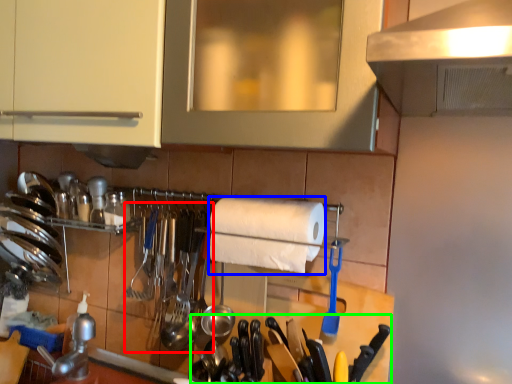
Question: Estimate the real-world distances between objects in this image. Which object is farther from silverware (highlighted by a red box), paper towel (highlighted by a blue box) or cutlery (highlighted by a green box)?

Choices:
 (A) paper towel
 (B) cutlery

Answer: (A)